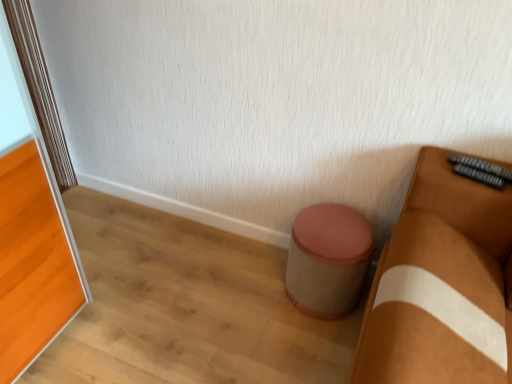
The image size is (512, 384). What do you see at coordinates (33, 247) in the screenshot?
I see `orange glossy screen door at left` at bounding box center [33, 247].

Where is `orange glossy screen door at left`? The image size is (512, 384). orange glossy screen door at left is located at coordinates point(33,247).

What is the approximate height of orange glossy screen door at left?

orange glossy screen door at left is 1.15 meters in height.

Describe the element at coordinates (328, 259) in the screenshot. I see `beige fabric stool at center` at that location.

This screenshot has width=512, height=384. Identify the location of beige fabric stool at center. (328, 259).

Identify the location of orange glossy screen door at left. This screenshot has height=384, width=512. (33, 247).

Which is more to the right, beige fabric stool at center or orange glossy screen door at left?

beige fabric stool at center is more to the right.

Considering the positions of objects beige fabric stool at center and orange glossy screen door at left in the image provided, who is in front, beige fabric stool at center or orange glossy screen door at left?

orange glossy screen door at left.

Considering the positions of point (353, 298) and point (36, 280), is point (353, 298) closer or farther from the camera than point (36, 280)?

Point (353, 298).

From the image's perspective, which is above, beige fabric stool at center or orange glossy screen door at left?

From the image's view, orange glossy screen door at left is above.

From a real-world perspective, who is located lower, beige fabric stool at center or orange glossy screen door at left?

In real-world perspective, beige fabric stool at center is lower.

Is beige fabric stool at center wider or thinner than orange glossy screen door at left?

Clearly, beige fabric stool at center has more width compared to orange glossy screen door at left.

Who is shorter, beige fabric stool at center or orange glossy screen door at left?

With less height is beige fabric stool at center.

Does beige fabric stool at center have a larger size compared to orange glossy screen door at left?

No, beige fabric stool at center is not bigger than orange glossy screen door at left.

Which is correct: beige fabric stool at center is inside orange glossy screen door at left, or outside of it?

beige fabric stool at center lies outside orange glossy screen door at left.

Would you consider beige fabric stool at center to be distant from orange glossy screen door at left?

beige fabric stool at center is actually quite close to orange glossy screen door at left.

Is beige fabric stool at center oriented away from orange glossy screen door at left?

No.

Where is `screen door that appears in front of the beige fabric stool at center`? This screenshot has width=512, height=384. screen door that appears in front of the beige fabric stool at center is located at coordinates (33, 247).

Looking at this image, can you confirm if orange glossy screen door at left is positioned to the left of beige fabric stool at center?

Indeed, orange glossy screen door at left is positioned on the left side of beige fabric stool at center.

Considering their positions, is orange glossy screen door at left located in front of or behind beige fabric stool at center?

In the image, orange glossy screen door at left appears in front of beige fabric stool at center.

Which point is more distant from viewer, (36, 270) or (300, 260)?

The point (300, 260) is farther from the camera.

From the image's perspective, would you say orange glossy screen door at left is shown under beige fabric stool at center?

Incorrect, from the image's perspective, orange glossy screen door at left is higher than beige fabric stool at center.

From a real-world perspective, is orange glossy screen door at left located beneath beige fabric stool at center?

Incorrect, from a real-world perspective, orange glossy screen door at left is higher than beige fabric stool at center.

Considering the relative sizes of orange glossy screen door at left and beige fabric stool at center in the image provided, is orange glossy screen door at left thinner than beige fabric stool at center?

Yes, orange glossy screen door at left is thinner than beige fabric stool at center.

Considering the sizes of objects orange glossy screen door at left and beige fabric stool at center in the image provided, who is taller, orange glossy screen door at left or beige fabric stool at center?

With more height is orange glossy screen door at left.

Who is smaller, orange glossy screen door at left or beige fabric stool at center?

beige fabric stool at center is smaller.

Can beige fabric stool at center be found inside orange glossy screen door at left?

Actually, beige fabric stool at center is outside orange glossy screen door at left.

Is orange glossy screen door at left far from beige fabric stool at center?

No, orange glossy screen door at left is in close proximity to beige fabric stool at center.

Is orange glossy screen door at left oriented away from beige fabric stool at center?

No, orange glossy screen door at left is not facing away from beige fabric stool at center.

What's the angular difference between orange glossy screen door at left and beige fabric stool at center's facing directions?

89.8 degrees separate the facing orientations of orange glossy screen door at left and beige fabric stool at center.

Identify the location of stool lying behind the orange glossy screen door at left. (328, 259).

The height and width of the screenshot is (384, 512). Identify the location of screen door that is above the beige fabric stool at center (from a real-world perspective). (33, 247).

Locate an element on the screen. Image resolution: width=512 pixels, height=384 pixels. stool on the right of orange glossy screen door at left is located at coordinates 328,259.